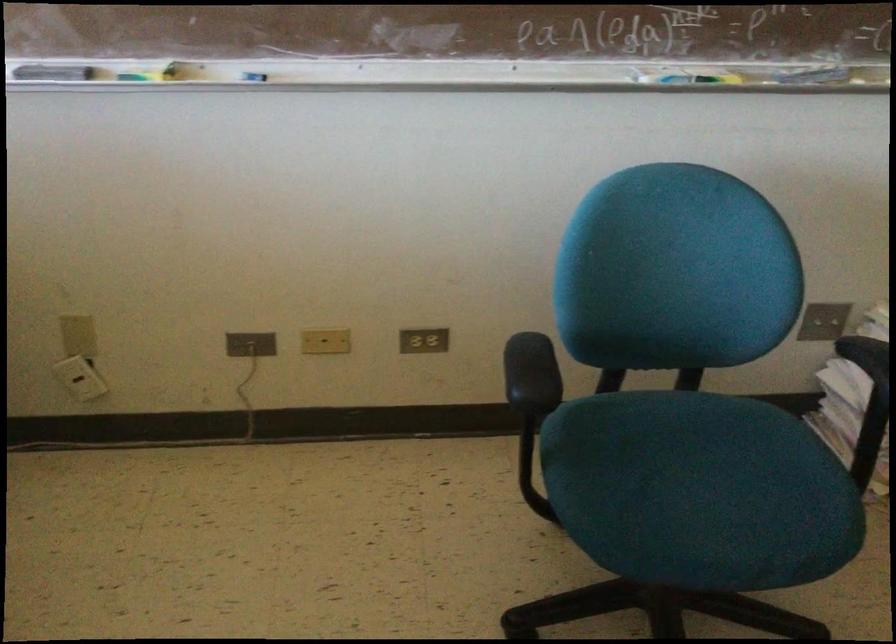
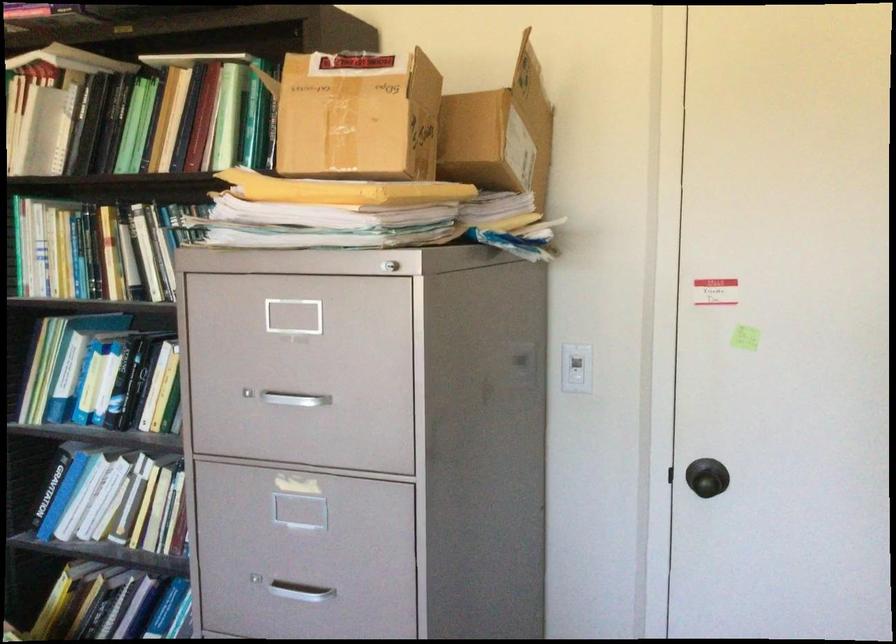
Question: The images are taken continuously from a first-person perspective. In which direction is your viewpoint rotating?

Choices:
 (A) Left
 (B) Right
 (C) Up
 (D) Down

Answer: (B)